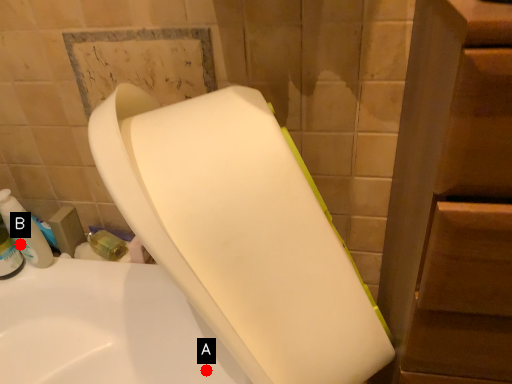
Question: Two points are circled on the image, labeled by A and B beside each circle. Which point is closer to the camera?

Choices:
 (A) A is closer
 (B) B is closer

Answer: (A)